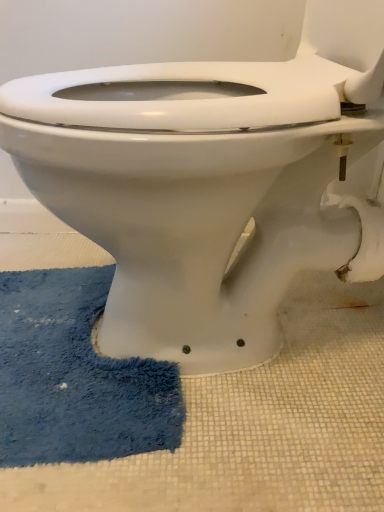
What are the coordinates of `free spot above blue plush bath mat at lower left (from a real-world perspective)` in the screenshot? It's located at (79, 339).